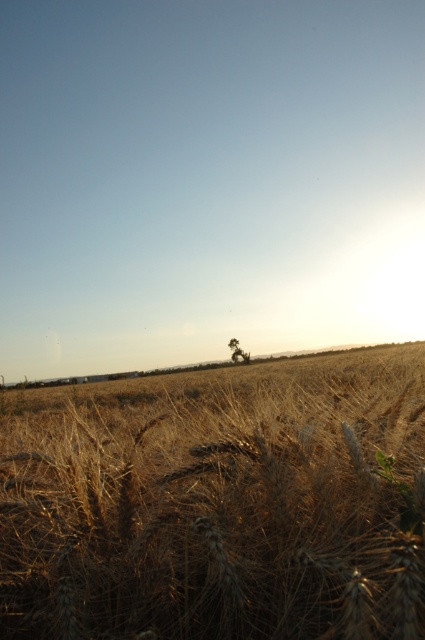
Question: Is brown textured wheat at center further to the viewer compared to brown textured tree at center?

Choices:
 (A) no
 (B) yes

Answer: (A)

Question: Observing the image, what is the correct spatial positioning of brown textured wheat at center in reference to brown textured tree at center?

Choices:
 (A) below
 (B) above

Answer: (B)

Question: Among these objects, which one is farthest from the camera?

Choices:
 (A) brown textured wheat at center
 (B) brown textured tree at center

Answer: (B)

Question: Does brown textured wheat at center appear under brown textured tree at center?

Choices:
 (A) yes
 (B) no

Answer: (B)

Question: Which point appears farthest from the camera in this image?

Choices:
 (A) (288, 440)
 (B) (246, 358)

Answer: (B)